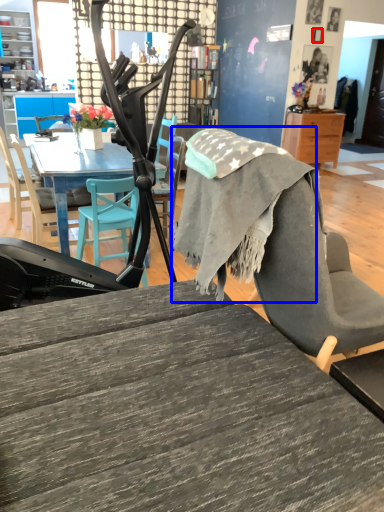
Question: Which of the following is the closest to the observer, picture frame (highlighted by a red box) or fabric (highlighted by a blue box)?

Choices:
 (A) picture frame
 (B) fabric

Answer: (B)